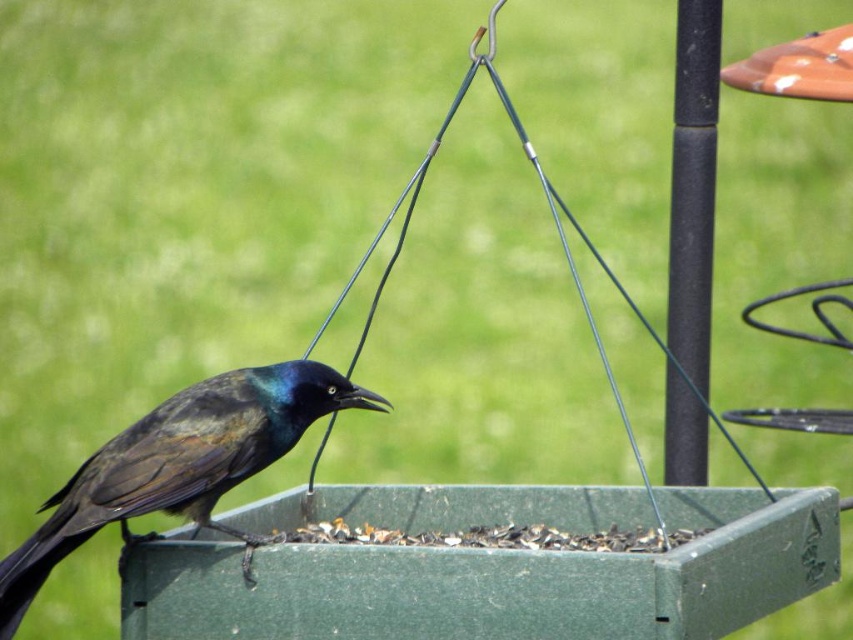
Question: Is shiny black bird at center closer to the viewer compared to black matte pole at upper right?

Choices:
 (A) no
 (B) yes

Answer: (B)

Question: Can you confirm if shiny black bird at center is bigger than black matte pole at upper right?

Choices:
 (A) yes
 (B) no

Answer: (B)

Question: Does shiny black bird at center have a larger size compared to black matte pole at upper right?

Choices:
 (A) no
 (B) yes

Answer: (A)